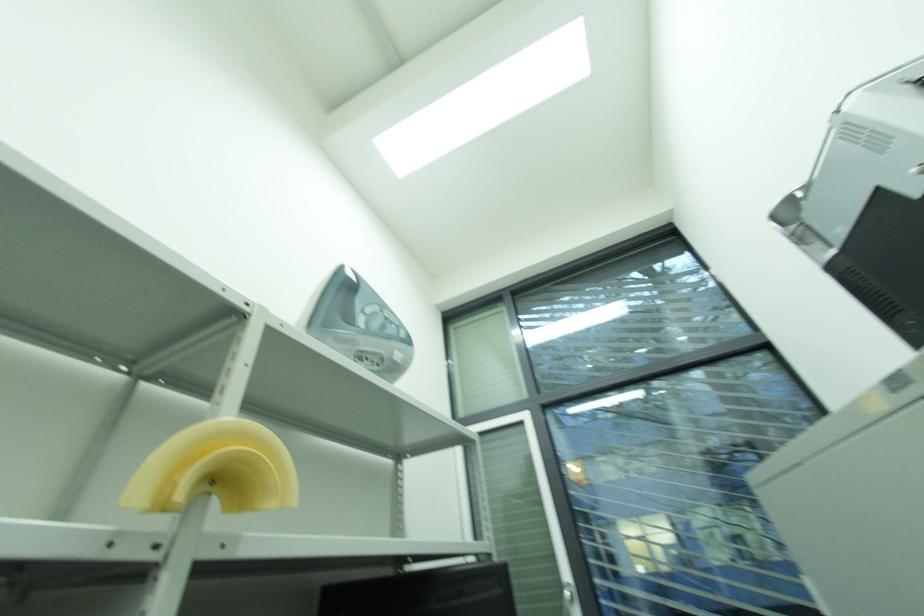
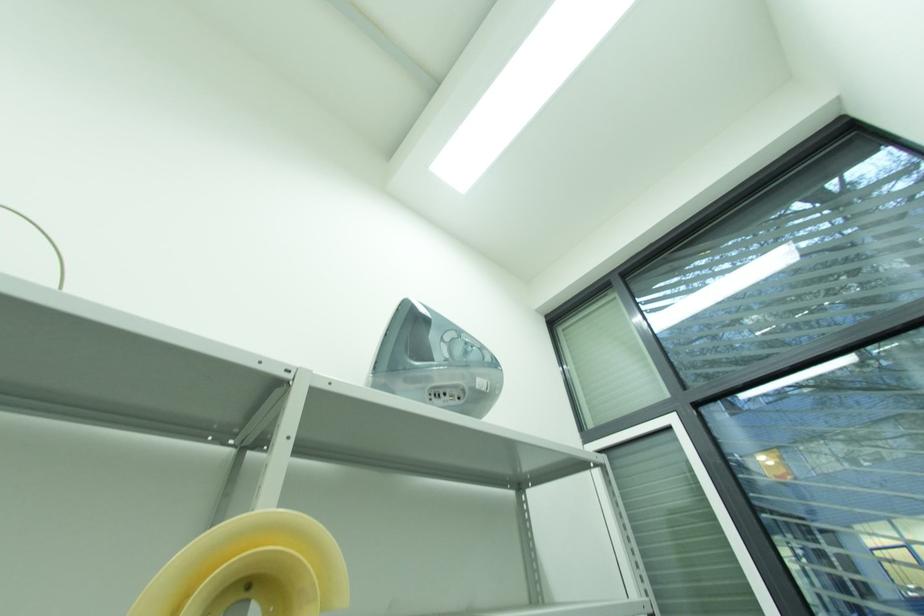
Which direction would the cameraman need to move to produce the second image?

The movement direction of the cameraman is right, forward.